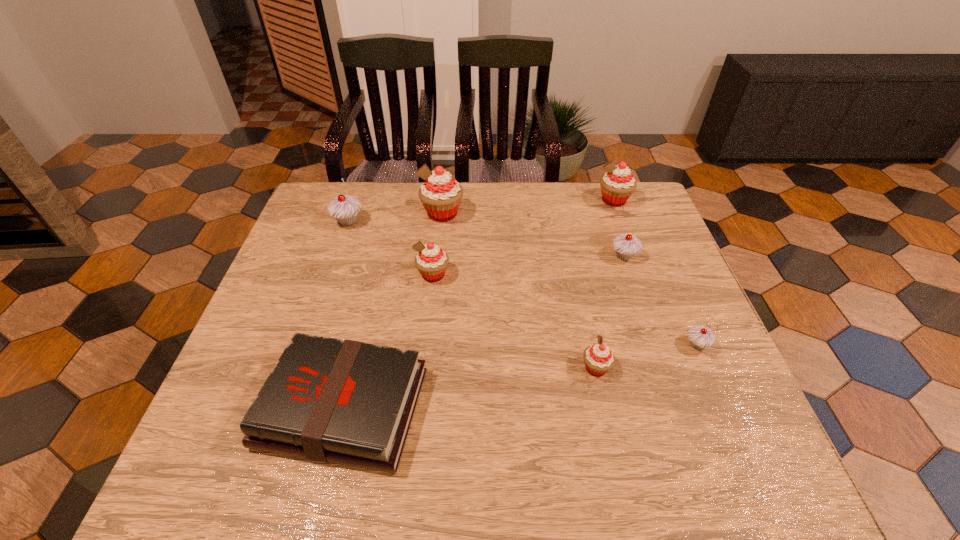
Image resolution: width=960 pixels, height=540 pixels. In order to click on the biggest pink cupcake in this screenshot , I will do `click(440, 194)`.

The height and width of the screenshot is (540, 960). What are the coordinates of `the tallest object` in the screenshot? It's located at (440, 194).

Find the location of a particular element. the leftmost gray cupcake is located at coordinates (344, 209).

The image size is (960, 540). Find the location of `the biggest gray cupcake`. the biggest gray cupcake is located at coordinates 344,209.

You are a GUI agent. You are given a task and a screenshot of the screen. Output one action in this format:
    pyautogui.click(x=<x>, y=<y>)
    Task: Click on the third smallest pink cupcake
    The image size is (960, 540).
    Given the screenshot: What is the action you would take?
    pyautogui.click(x=617, y=185)

This screenshot has height=540, width=960. Find the location of `the second farthest gray cupcake`. the second farthest gray cupcake is located at coordinates (625, 245).

The image size is (960, 540). I want to click on the second gray cupcake from right to left, so click(625, 245).

You are a GUI agent. You are given a task and a screenshot of the screen. Output one action in this format:
    pyautogui.click(x=<x>, y=<y>)
    Task: Click on the second nearest pink cupcake
    The image size is (960, 540).
    Given the screenshot: What is the action you would take?
    [x=431, y=261]

This screenshot has height=540, width=960. What are the coordinates of `the rightmost gray cupcake` in the screenshot? It's located at (700, 337).

Where is `the nearest gray cupcake`? This screenshot has width=960, height=540. the nearest gray cupcake is located at coordinates (700, 337).